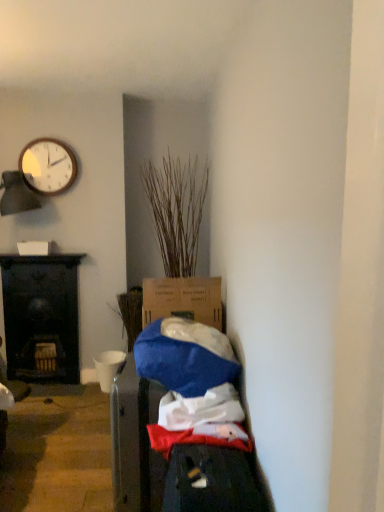
Question: Would you say matte white clock at upper left is part of dry grass at center's contents?

Choices:
 (A) yes
 (B) no

Answer: (B)

Question: Can you confirm if dry grass at center is wider than matte white clock at upper left?

Choices:
 (A) yes
 (B) no

Answer: (A)

Question: From the image's perspective, is dry grass at center under matte white clock at upper left?

Choices:
 (A) no
 (B) yes

Answer: (B)

Question: Is dry grass at center bigger than matte white clock at upper left?

Choices:
 (A) yes
 (B) no

Answer: (A)

Question: From a real-world perspective, is dry grass at center over matte white clock at upper left?

Choices:
 (A) yes
 (B) no

Answer: (B)

Question: From the image's perspective, is dry grass at center on top of matte white clock at upper left?

Choices:
 (A) yes
 (B) no

Answer: (B)

Question: Is black wood desk at left outside of matte white clock at upper left?

Choices:
 (A) no
 (B) yes

Answer: (B)

Question: Can you see black wood desk at left touching matte white clock at upper left?

Choices:
 (A) yes
 (B) no

Answer: (B)

Question: Considering the relative sizes of black wood desk at left and matte white clock at upper left in the image provided, is black wood desk at left wider than matte white clock at upper left?

Choices:
 (A) no
 (B) yes

Answer: (B)

Question: Can you confirm if black wood desk at left is taller than matte white clock at upper left?

Choices:
 (A) no
 (B) yes

Answer: (B)

Question: From the image's perspective, is black wood desk at left under matte white clock at upper left?

Choices:
 (A) yes
 (B) no

Answer: (A)

Question: Does black wood desk at left have a lesser height compared to matte white clock at upper left?

Choices:
 (A) no
 (B) yes

Answer: (A)

Question: From a real-world perspective, does matte white clock at upper left stand above dry grass at center?

Choices:
 (A) no
 (B) yes

Answer: (B)